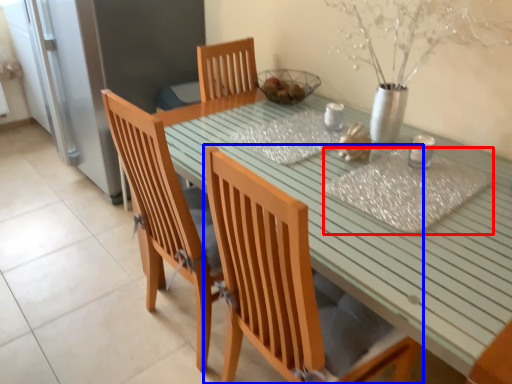
Question: Which object appears closest to the camera in this image, place mat (highlighted by a red box) or chair (highlighted by a blue box)?

Choices:
 (A) place mat
 (B) chair

Answer: (B)